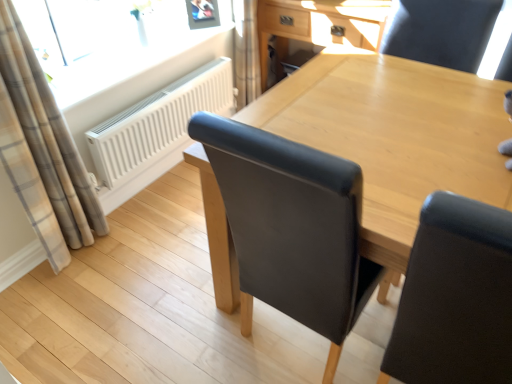
Find the location of a particular element. free space in front of plaid fabric curtain at left is located at coordinates (62, 299).